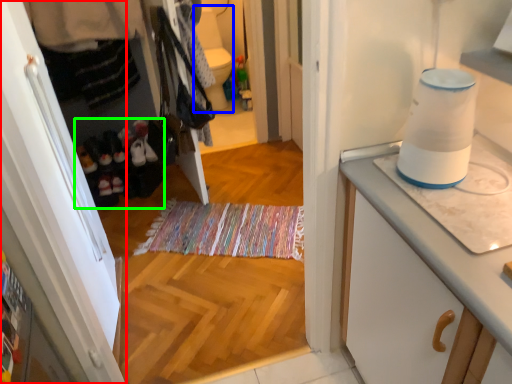
Question: Which object is positioned farthest from cabinetry (highlighted by a red box)? Select from toilet bowl (highlighted by a blue box) and footwear (highlighted by a green box).

Choices:
 (A) toilet bowl
 (B) footwear

Answer: (A)